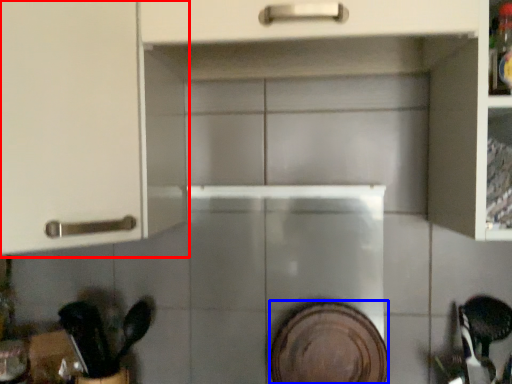
Question: Which object is further to the camera taking this photo, cabinetry (highlighted by a red box) or platter (highlighted by a blue box)?

Choices:
 (A) cabinetry
 (B) platter

Answer: (B)